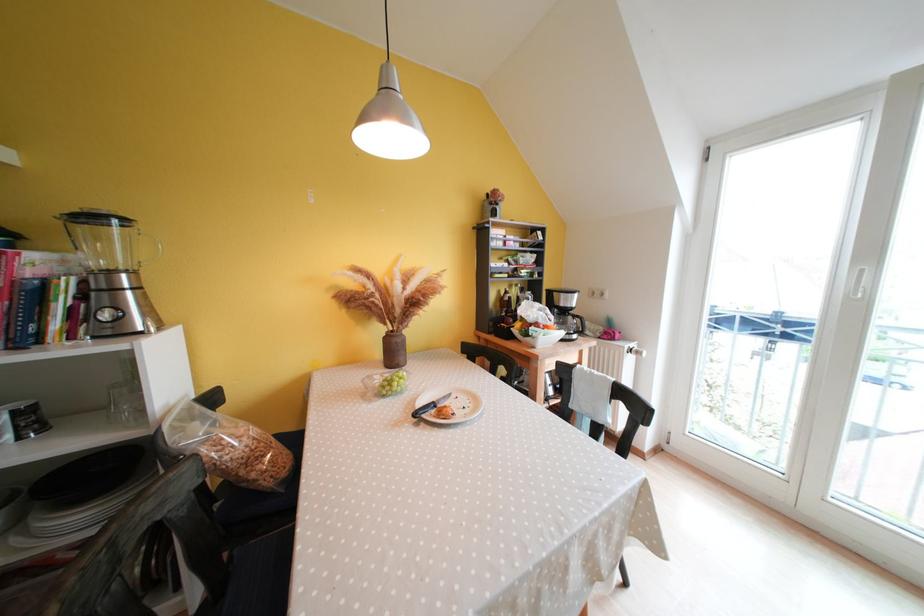
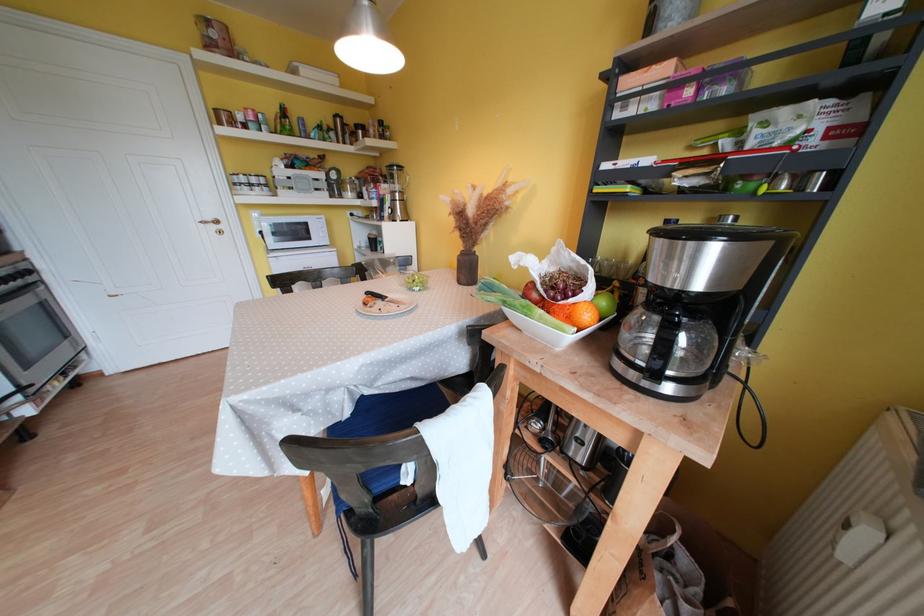
Find the pixel in the second image that matches the point at 440,408 in the first image.

(390, 301)